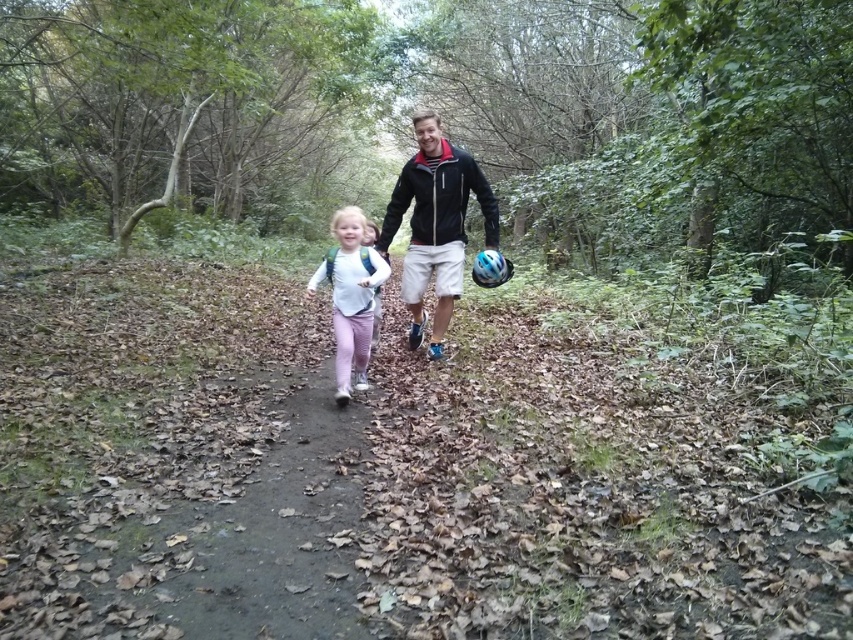
Question: Is green matte forest at center below white matte shirt at center?

Choices:
 (A) no
 (B) yes

Answer: (A)

Question: Which point is closer to the camera taking this photo?

Choices:
 (A) (672, 230)
 (B) (347, 285)

Answer: (B)

Question: Which point appears farthest from the camera in this image?

Choices:
 (A) (701, 176)
 (B) (338, 240)

Answer: (A)

Question: Can you confirm if green matte forest at center is positioned below white matte shirt at center?

Choices:
 (A) no
 (B) yes

Answer: (A)

Question: Which point is farther to the camera?

Choices:
 (A) green matte forest at center
 (B) white matte shirt at center

Answer: (A)

Question: Can you confirm if green matte forest at center is bigger than white matte shirt at center?

Choices:
 (A) no
 (B) yes

Answer: (B)